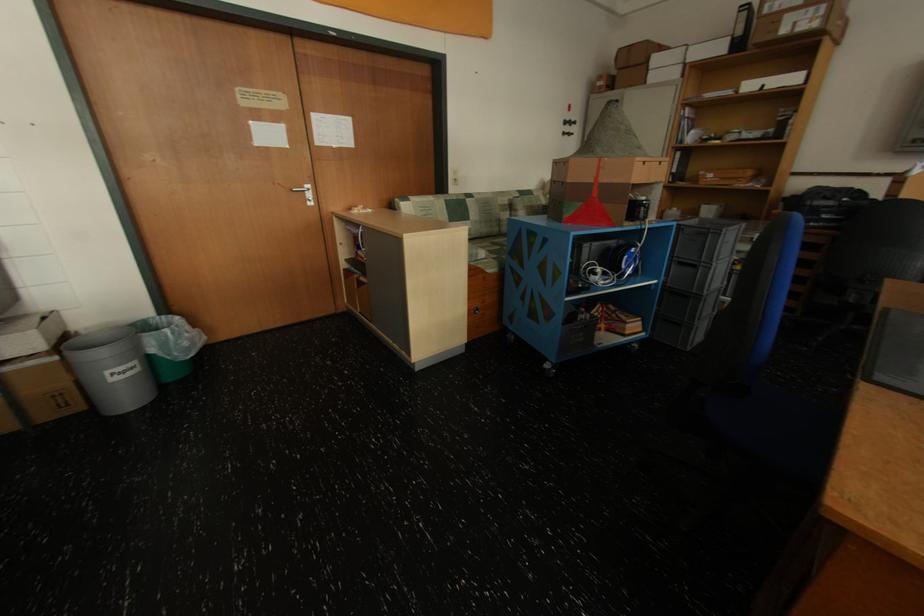
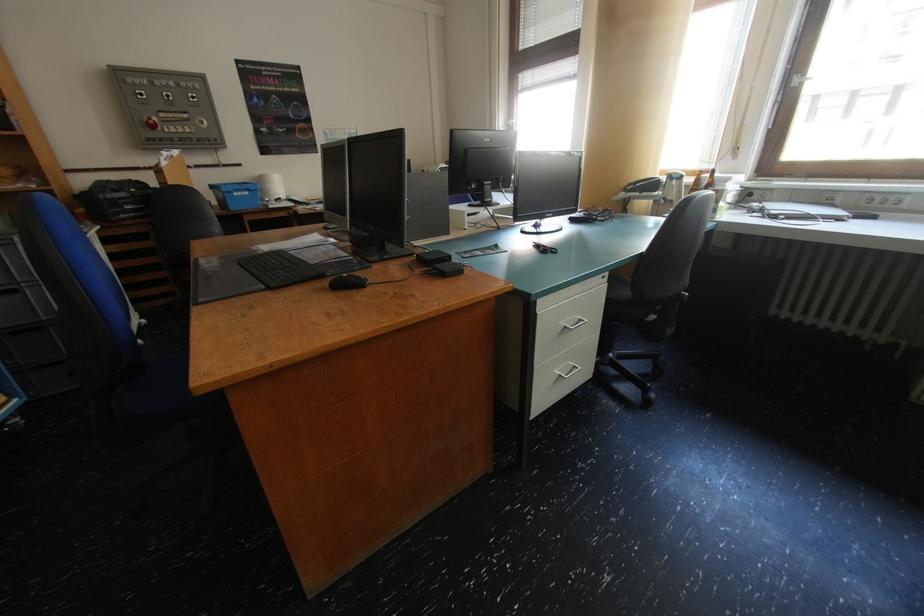
Based on the continuous images, in which direction is the camera rotating?

The camera's rotation is toward right-down.